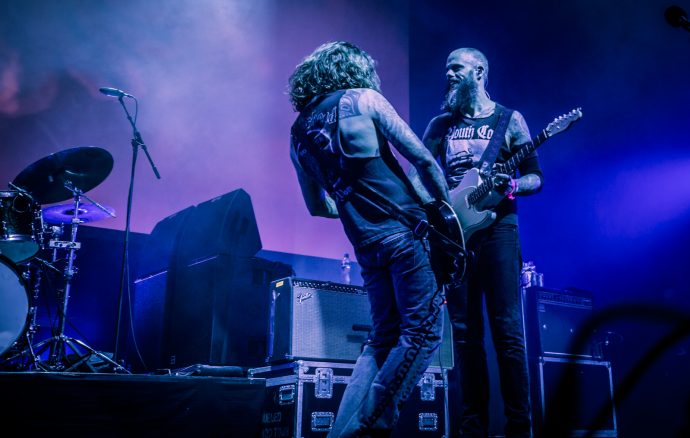
At what (x,y) coordinates should I click in order to perform the action: click on mic. Please return your answer as a coordinate pair (x, y). This screenshot has width=690, height=438. Looking at the image, I should click on (105, 87).